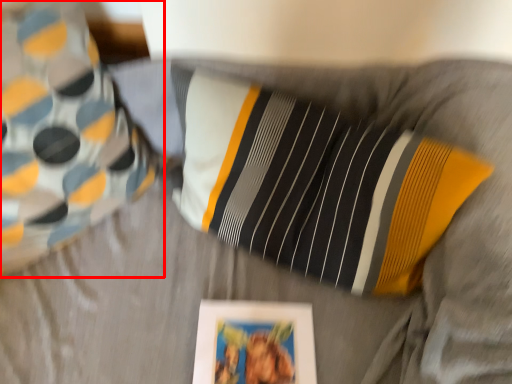
Question: In this image, where is pillow (annotated by the red box) located relative to picture frame?

Choices:
 (A) right
 (B) left

Answer: (B)